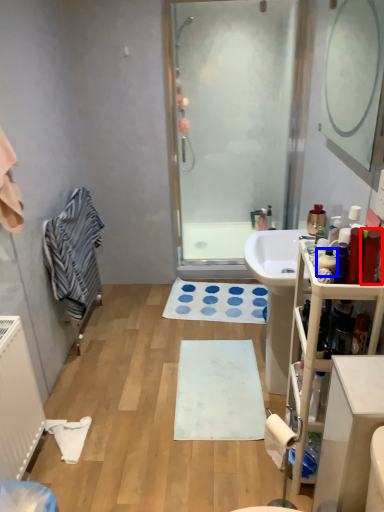
Question: Which object appears farthest to the camera in this image, toiletry (highlighted by a red box) or toiletry (highlighted by a blue box)?

Choices:
 (A) toiletry
 (B) toiletry

Answer: (B)